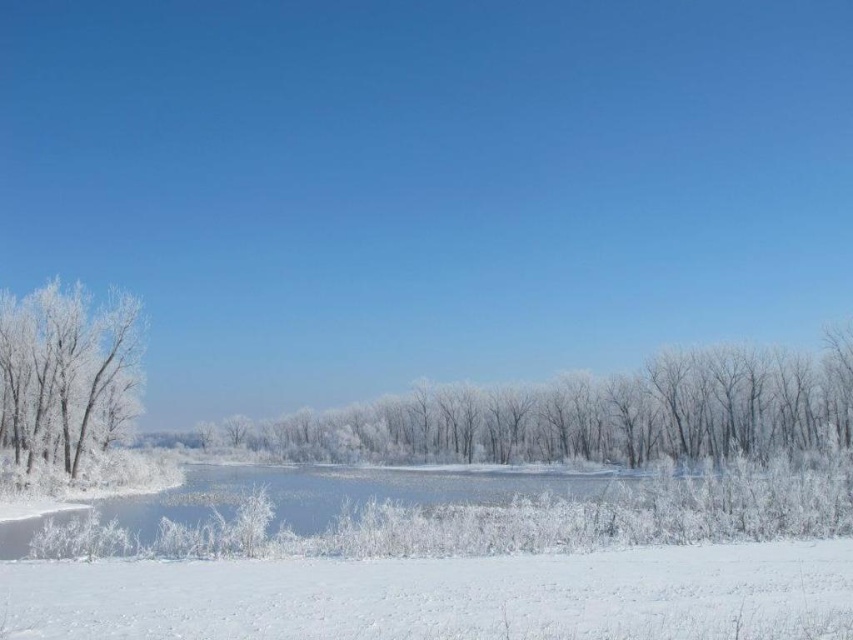
You are an artist planning to paint this winter scene. You want to ensure the white fluffy snow at lower center and the frosted glass tree at left are proportionally accurate. Which object should you make larger in your painting?

The frosted glass tree at left should be made larger in the painting because it occupies more space than the white fluffy snow at lower center according to the description.

You are standing in the winter landscape and want to walk from the frosted glass tree at left to the white frosty trees at center. Which direction should you move?

You should move to the right to reach the white frosty trees at center from the frosted glass tree at left because the white frosty trees at center are located to the right of the frosted glass tree at left.

You are standing at the edge of the scene and want to walk towards the frosted glass tree at left. Which direction should you move relative to the white fluffy snow at lower center?

You should move to the left relative to the white fluffy snow at lower center because the frosted glass tree at left is positioned to the left of the white fluffy snow at lower center.